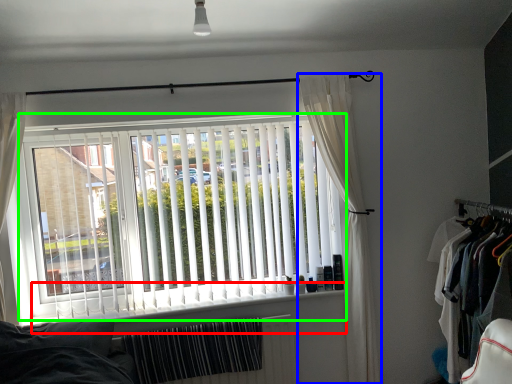
Question: Based on their relative distances, which object is nearer to window sill (highlighted by a red box)? Choose from curtain (highlighted by a blue box) and window blind (highlighted by a green box).

Choices:
 (A) curtain
 (B) window blind

Answer: (B)